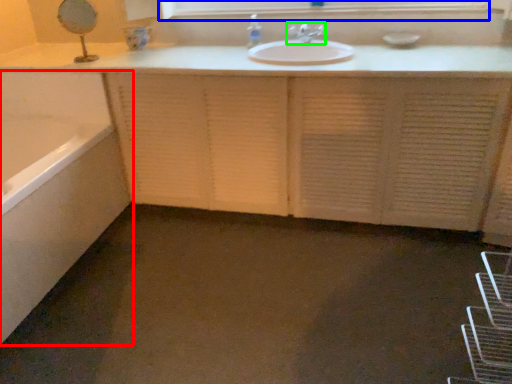
Question: Based on their relative distances, which object is nearer to bathtub (highlighted by a red box)? Choose from medicine cabinet (highlighted by a blue box) and tap (highlighted by a green box).

Choices:
 (A) medicine cabinet
 (B) tap

Answer: (A)